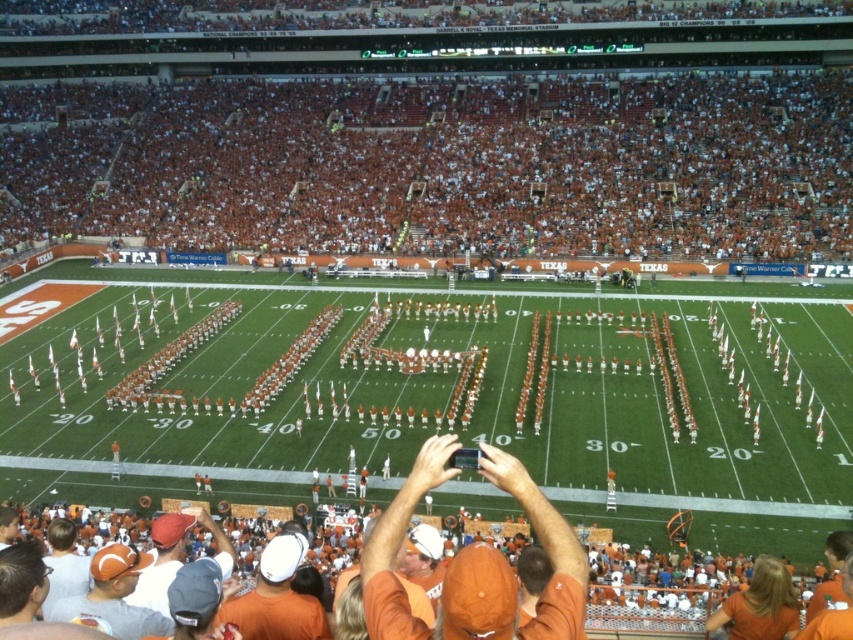
Question: Observing the image, what is the correct spatial positioning of orange cotton shirt at center in reference to orange cotton shirt at lower left?

Choices:
 (A) above
 (B) below

Answer: (A)

Question: Which of the following is the closest to the observer?

Choices:
 (A) orange cotton shirt at lower left
 (B) orange cotton shirt at center

Answer: (B)

Question: Is orange cotton shirt at center to the left of orange cotton shirt at lower left from the viewer's perspective?

Choices:
 (A) yes
 (B) no

Answer: (B)

Question: Which object is closer to the camera taking this photo?

Choices:
 (A) orange cotton shirt at lower left
 (B) orange cotton shirt at center

Answer: (B)

Question: Does orange cotton shirt at center appear over orange cotton shirt at lower left?

Choices:
 (A) yes
 (B) no

Answer: (A)